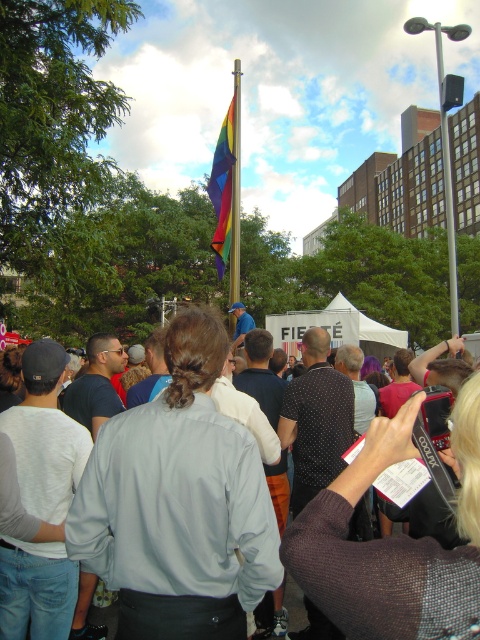
Question: Which of the following is the farthest from the observer?

Choices:
 (A) gray fabric crowd at center
 (B) metallic rainbow flag pole at center

Answer: (B)

Question: Which point is farther to the camera?

Choices:
 (A) pos(232,253)
 (B) pos(291,538)
 (C) pos(443,150)
 (D) pos(218,140)

Answer: (C)

Question: Which is farther from the gray fabric crowd at center?

Choices:
 (A) metallic rainbow flag pole at center
 (B) metallic flag pole at upper center
 (C) rainbow fabric flag at center

Answer: (B)

Question: Can you confirm if rainbow fabric flag at center is wider than metallic flag pole at upper center?

Choices:
 (A) yes
 (B) no

Answer: (B)

Question: Does gray fabric crowd at center have a greater width compared to rainbow fabric flag at center?

Choices:
 (A) no
 (B) yes

Answer: (A)

Question: Is gray fabric crowd at center positioned in front of metallic rainbow flag pole at center?

Choices:
 (A) no
 (B) yes

Answer: (B)